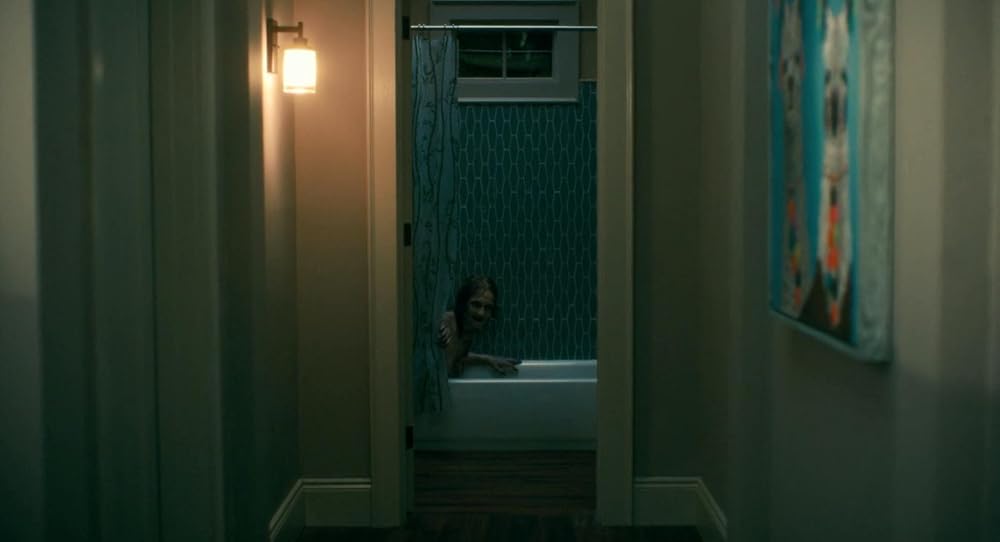
At what (x,y) coordinates should I click in order to perform the action: click on sconce on wall. Please return your answer as a coordinate pair (x, y). Looking at the image, I should click on (268, 38).